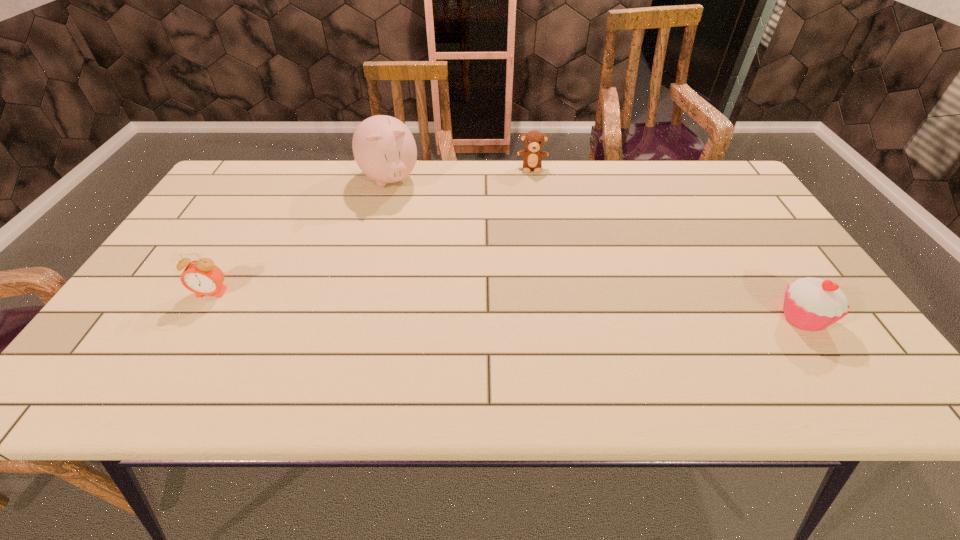
Identify the location of the leftmost object. This screenshot has height=540, width=960. (202, 277).

At what (x,y) coordinates should I click in order to perform the action: click on cupcake. Please return your answer as a coordinate pair (x, y). Image resolution: width=960 pixels, height=540 pixels. Looking at the image, I should click on (812, 304).

What are the coordinates of `the second object from right to left` in the screenshot? It's located at (533, 140).

Locate an element on the screen. Image resolution: width=960 pixels, height=540 pixels. the second object from left to right is located at coordinates (384, 148).

Identify the location of piggy bank. This screenshot has width=960, height=540. (384, 148).

The height and width of the screenshot is (540, 960). Identify the location of vacant space located on the face of the leftmost object. (177, 353).

Locate an element on the screen. Image resolution: width=960 pixels, height=540 pixels. vacant region located 0.060m on the left of the rightmost object is located at coordinates (748, 318).

At what (x,y) coordinates should I click in order to perform the action: click on free space located 0.120m on the face of the second object from right to left. Please return your answer as a coordinate pair (x, y). The height and width of the screenshot is (540, 960). Looking at the image, I should click on (533, 196).

What are the coordinates of `free point located 0.350m on the face of the second object from right to left` in the screenshot? It's located at (534, 247).

You are a GUI agent. You are given a task and a screenshot of the screen. Output one action in this format:
    pyautogui.click(x=<x>, y=<y>)
    Task: Click on the free space located 0.060m on the face of the second object from right to left
    
    Given the screenshot: What is the action you would take?
    pyautogui.click(x=532, y=185)